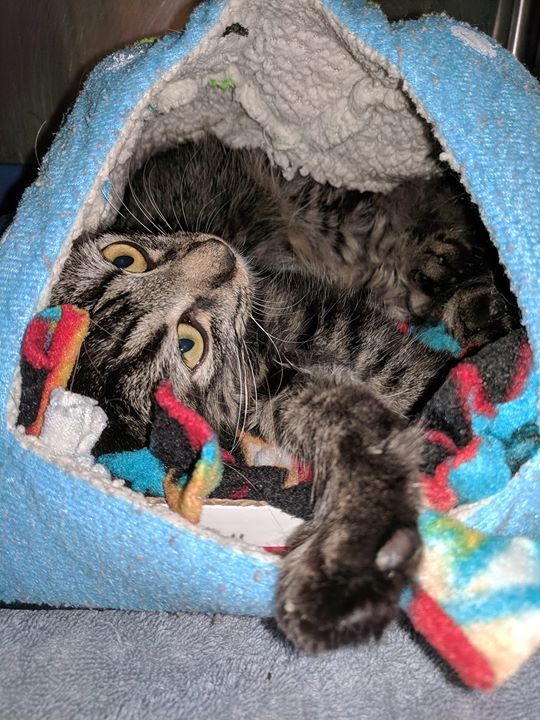
Find the location of a particular element. blanket is located at coordinates (506, 636).